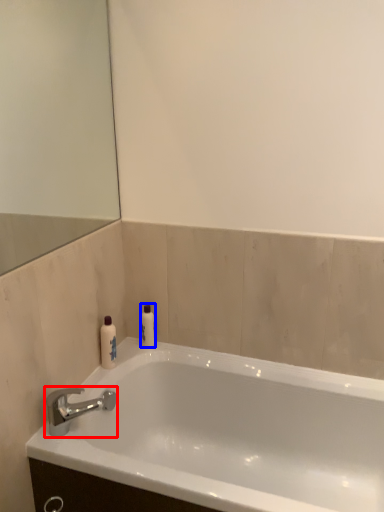
Question: Among these objects, which one is nearest to the camera, tap (highlighted by a red box) or toiletry (highlighted by a blue box)?

Choices:
 (A) tap
 (B) toiletry

Answer: (A)